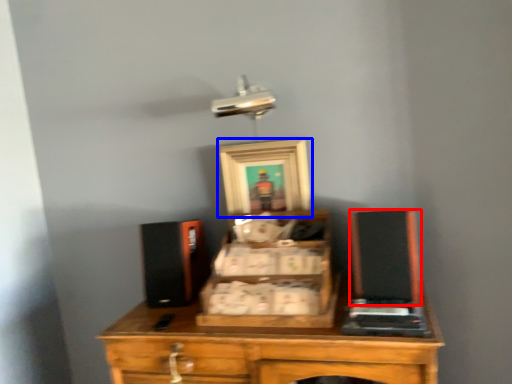
Question: Which point is closer to the camera, wide (highlighted by a red box) or picture frame (highlighted by a blue box)?

Choices:
 (A) wide
 (B) picture frame

Answer: (A)